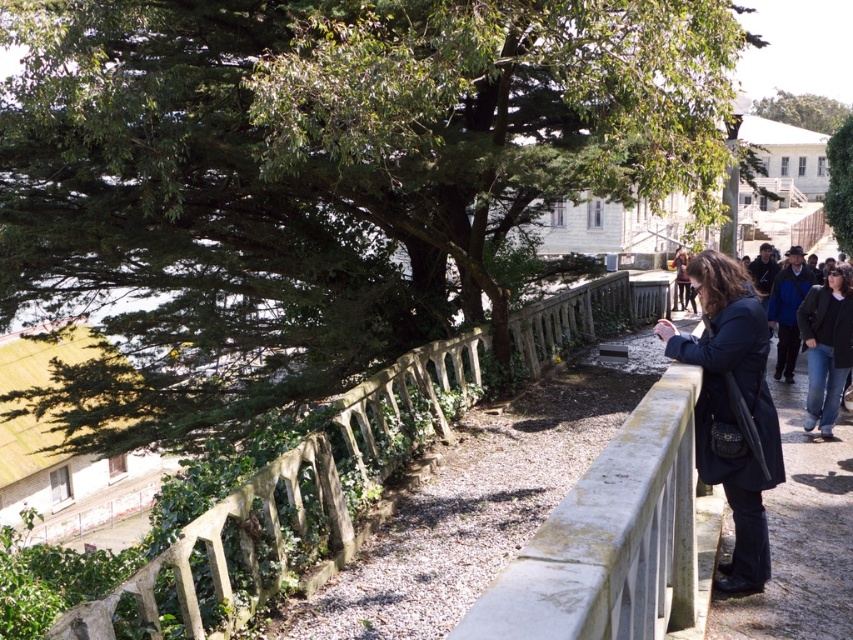
Can you confirm if stone textured fence at center is positioned above green leafy tree at upper right?

No, stone textured fence at center is not above green leafy tree at upper right.

How distant is stone textured fence at center from green leafy tree at upper right?

stone textured fence at center is 14.45 meters from green leafy tree at upper right.

At what (x,y) coordinates should I click in order to perform the action: click on stone textured fence at center. Please return your answer as a coordinate pair (x, y). The image size is (853, 640). Looking at the image, I should click on (289, 502).

What are the coordinates of `stone textured fence at center` in the screenshot? It's located at (289, 502).

Is dark blue coat at center above green leafy tree at upper right?

Actually, dark blue coat at center is below green leafy tree at upper right.

Consider the image. Can you confirm if dark blue coat at center is smaller than green leafy tree at upper right?

Yes.

This screenshot has height=640, width=853. What do you see at coordinates (732, 410) in the screenshot? I see `dark blue coat at center` at bounding box center [732, 410].

Locate an element on the screen. This screenshot has width=853, height=640. dark blue coat at center is located at coordinates (732, 410).

Is the position of green leafy tree at upper left less distant than that of dark blue jeans at lower right?

Yes, green leafy tree at upper left is closer to the viewer.

The width and height of the screenshot is (853, 640). I want to click on green leafy tree at upper left, so click(323, 176).

You are a GUI agent. You are given a task and a screenshot of the screen. Output one action in this format:
    pyautogui.click(x=<x>, y=<y>)
    Task: Click on the green leafy tree at upper left
    
    Given the screenshot: What is the action you would take?
    pyautogui.click(x=323, y=176)